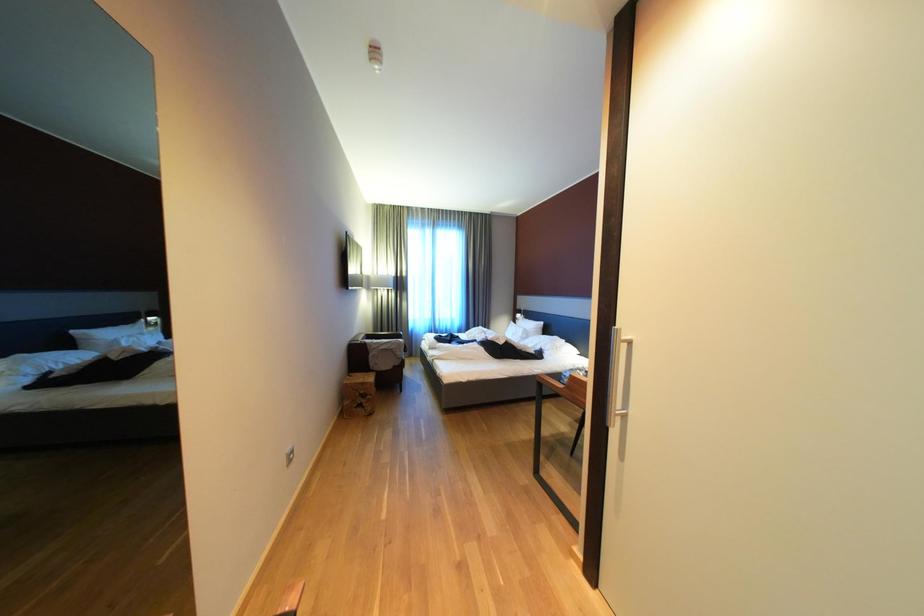
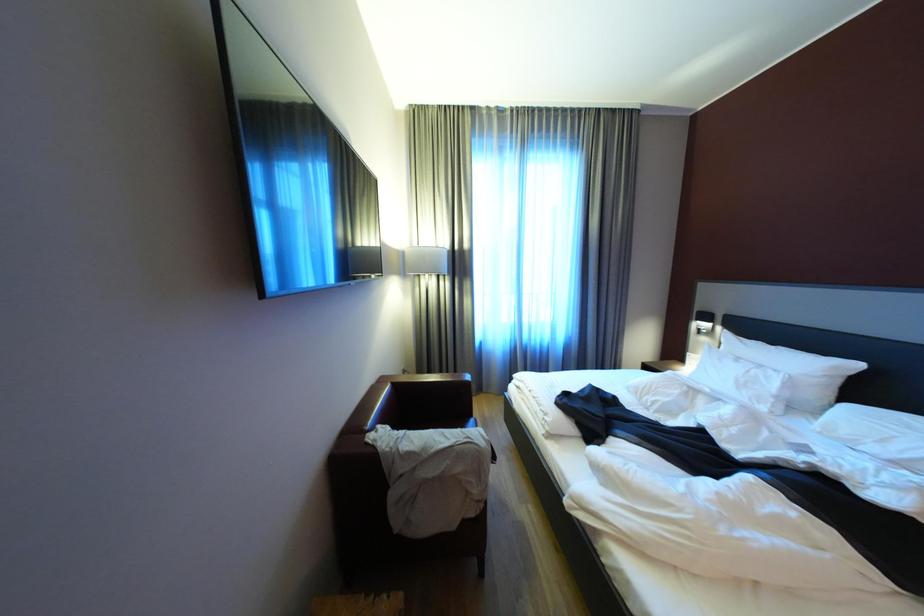
Question: In a continuous first-person perspective shot, in which direction is the camera moving?

Choices:
 (A) Left
 (B) Right
 (C) Forward
 (D) Backward

Answer: (C)